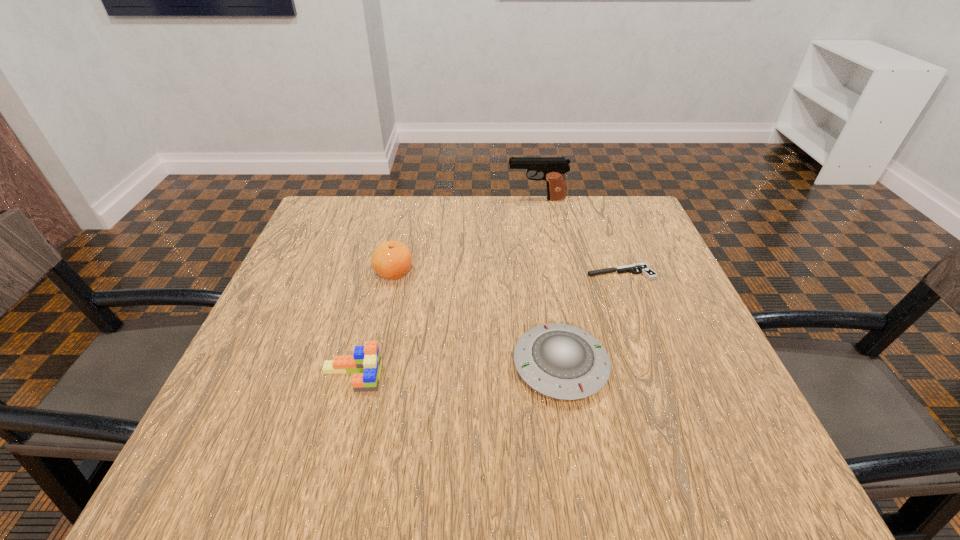
The image size is (960, 540). Find the location of `free space between the clementine and the nearer pistol`. free space between the clementine and the nearer pistol is located at coordinates (507, 272).

Identify the location of vacant area that lies between the Lego and the nearer pistol. (486, 325).

The width and height of the screenshot is (960, 540). I want to click on vacant space that's between the clementine and the Lego, so click(x=372, y=325).

Where is `free space between the shorter pistol and the farther pistol`? This screenshot has width=960, height=540. free space between the shorter pistol and the farther pistol is located at coordinates (579, 236).

This screenshot has height=540, width=960. In order to click on vacant space in between the right pistol and the Lego in this screenshot , I will do `click(486, 325)`.

Locate an element on the screen. Image resolution: width=960 pixels, height=540 pixels. free space between the Lego and the second shortest object is located at coordinates (456, 372).

Locate an element on the screen. the fourth closest object to the taller pistol is located at coordinates (366, 363).

Locate an element on the screen. This screenshot has height=540, width=960. object identified as the second closest to the taller pistol is located at coordinates click(x=392, y=259).

Find the location of a particular element. Image resolution: width=960 pixels, height=540 pixels. free location that satisfies the following two spatial constraints: 1. on the back side of the Lego; 2. on the right side of the second shortest object is located at coordinates (354, 366).

The height and width of the screenshot is (540, 960). Identify the location of vacant point that satisfies the following two spatial constraints: 1. on the back side of the clementine; 2. on the right side of the Lego. (379, 272).